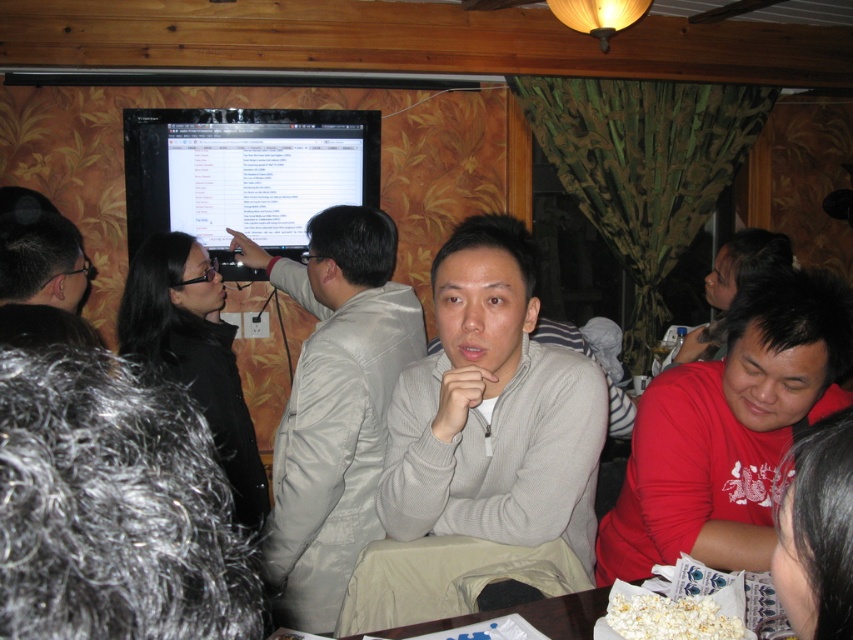
Question: Based on their relative distances, which object is nearer to the satin beige jacket at center?

Choices:
 (A) white paper plate at lower center
 (B) matte black monitor at upper left
 (C) red matte shirt at lower right
 (D) gray knit sweater at center

Answer: (D)

Question: Estimate the real-world distances between objects in this image. Which object is closer to the satin beige jacket at center?

Choices:
 (A) red matte shirt at lower right
 (B) white paper plate at lower center
 (C) matte black monitor at upper left

Answer: (A)

Question: Is red matte shirt at lower right positioned in front of white paper plate at lower center?

Choices:
 (A) no
 (B) yes

Answer: (B)

Question: Can you confirm if red matte shirt at lower right is wider than satin beige jacket at center?

Choices:
 (A) yes
 (B) no

Answer: (A)

Question: Which object is positioned farthest from the gray knit sweater at center?

Choices:
 (A) satin beige jacket at center
 (B) white paper plate at lower center

Answer: (A)

Question: Can you confirm if satin beige jacket at center is thinner than matte black monitor at upper left?

Choices:
 (A) no
 (B) yes

Answer: (B)